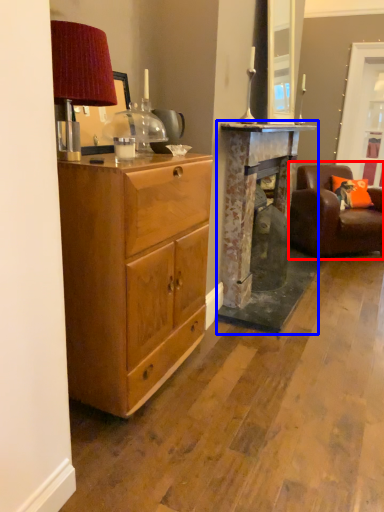
Question: Which of the following is the farthest to the observer, chair (highlighted by a red box) or fireplace (highlighted by a blue box)?

Choices:
 (A) chair
 (B) fireplace

Answer: (A)